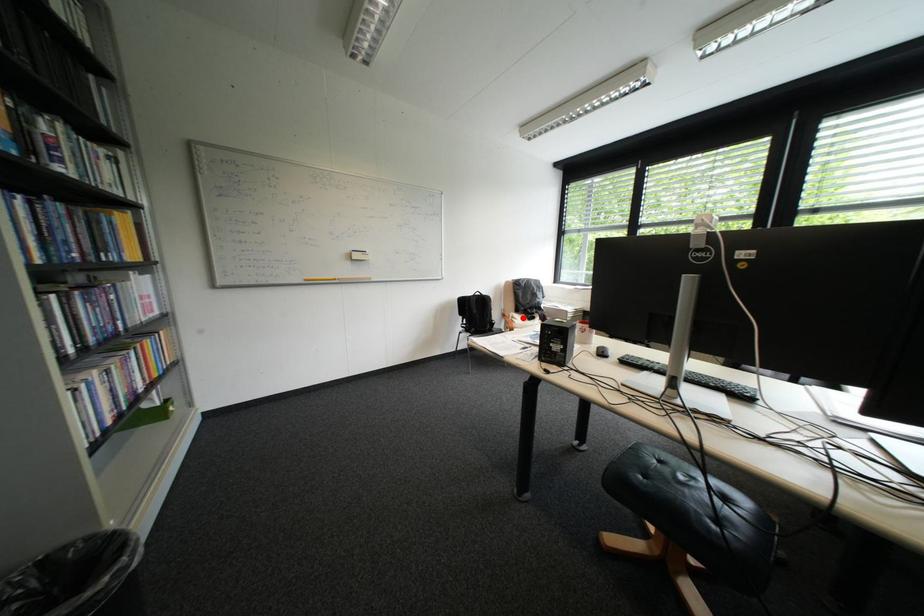
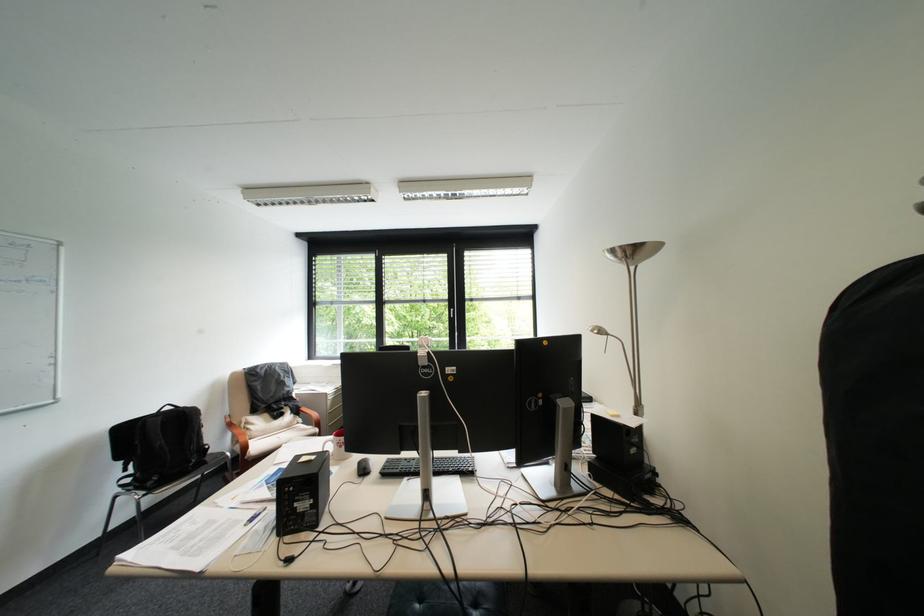
In the second image, find the point that corresponds to the highlighted location in the first image.

(256, 424)